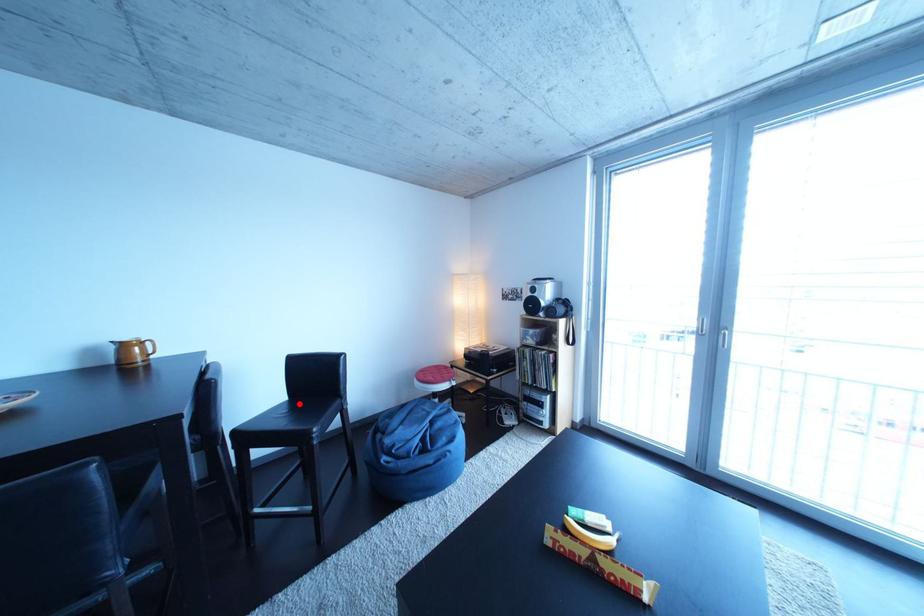
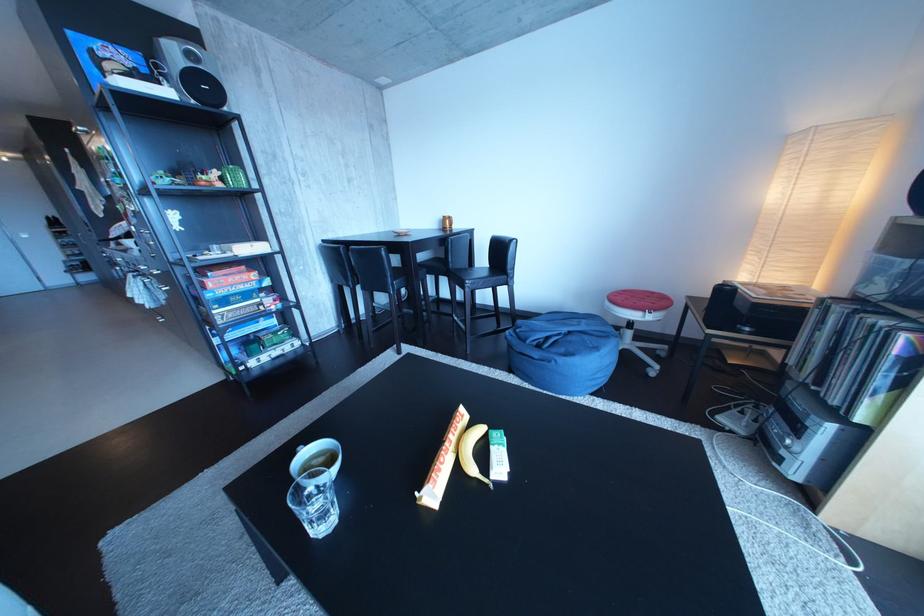
Question: I am providing you with two images of the same scene from different viewpoints. In image1, a red point is highlighted. Considering the same 3D point in image2, which of the following is correct?

Choices:
 (A) It is closer
 (B) It is farther

Answer: (A)